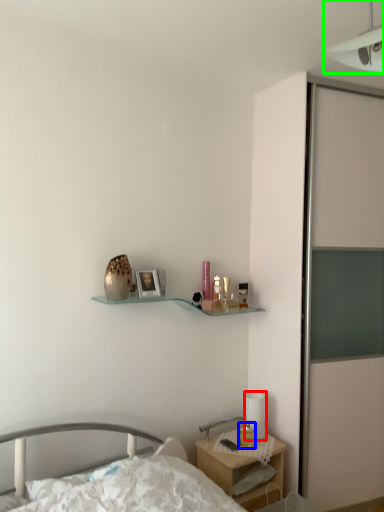
Question: Based on their relative distances, which object is farther from table lamp (highlighted by a red box)? Choose from candle holder (highlighted by a blue box) and light fixture (highlighted by a green box).

Choices:
 (A) candle holder
 (B) light fixture

Answer: (B)